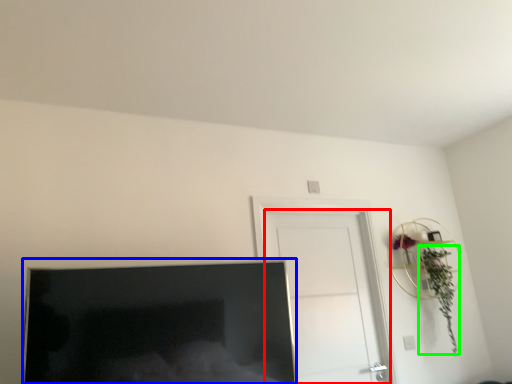
Question: Estimate the real-world distances between objects in this image. Which object is farther from door (highlighted by a red box), television (highlighted by a blue box) or plant (highlighted by a green box)?

Choices:
 (A) television
 (B) plant

Answer: (A)